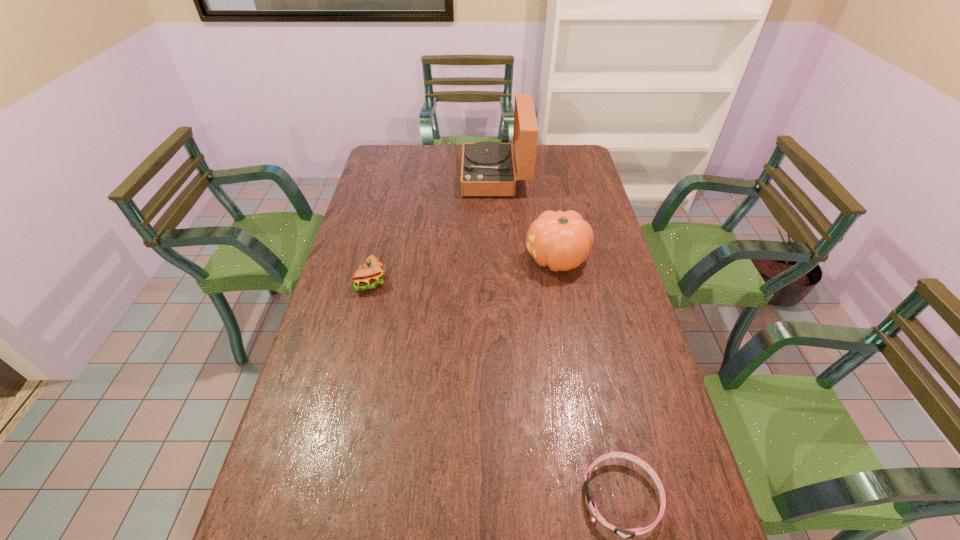
This screenshot has width=960, height=540. I want to click on the tallest object, so click(x=487, y=168).

Where is `the farthest object`? This screenshot has width=960, height=540. the farthest object is located at coordinates (487, 168).

I want to click on pumpkin, so (560, 240).

Find the location of a particular element. The image size is (960, 540). the second shortest object is located at coordinates coord(370,275).

Locate an element on the screen. the leftmost object is located at coordinates (370, 275).

Where is `vacant region located on the face of the farthest object`? This screenshot has height=540, width=960. vacant region located on the face of the farthest object is located at coordinates (409, 177).

Locate an element on the screen. free space located 0.200m on the face of the farthest object is located at coordinates (414, 177).

The image size is (960, 540). Find the location of `vacant area situated on the face of the farthest object`. vacant area situated on the face of the farthest object is located at coordinates (385, 177).

Locate an element on the screen. This screenshot has height=540, width=960. free location located 0.140m on the carved face of the pumpkin is located at coordinates (483, 259).

This screenshot has width=960, height=540. I want to click on free space located on the carved face of the pumpkin, so click(x=501, y=259).